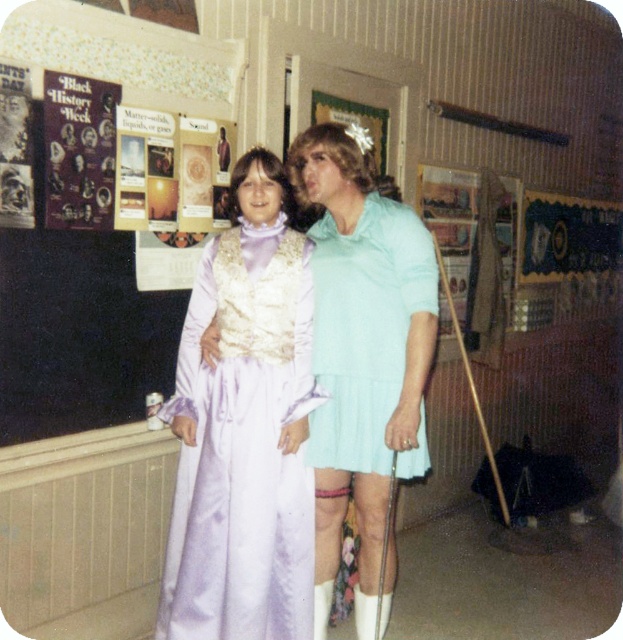
You are a costume designer preparing for a play. You have two items in front of you labeled as the light blue pleated dress at center and the light blue pleated skirt at center. The director wants to know which one is bigger. Which one should you choose?

The light blue pleated dress at center is larger in size than the light blue pleated skirt at center, so you should choose the light blue pleated dress at center.

In the scene shown: You are a photographer setting up for a group photo in the classroom. You need to position the lavender satin dress at center and the light blue pleated dress at center so that both are visible in the frame. Based on their current positions, which dress should be moved upward to ensure both are fully visible?

The lavender satin dress at center is located below the light blue pleated dress at center. To ensure both are fully visible, the light blue pleated dress at center should be moved upward so that the lavender satin dress at center isn not blocked.

You are a photographer trying to capture a group photo of the two people in the image. You need to ensure that both the lavender satin dress at center and the light blue pleated skirt at center are fully visible in the frame. Given that the camera has a fixed width, which person should you position closer to the camera to avoid cropping either garment?

The lavender satin dress at center is wider than the light blue pleated skirt at center. To ensure both garments are fully visible, position the person wearing the lavender satin dress at center closer to the camera. This adjustment will help maintain the dress within the frame without cropping, while the narrower skirt can remain further back and still be captured fully.